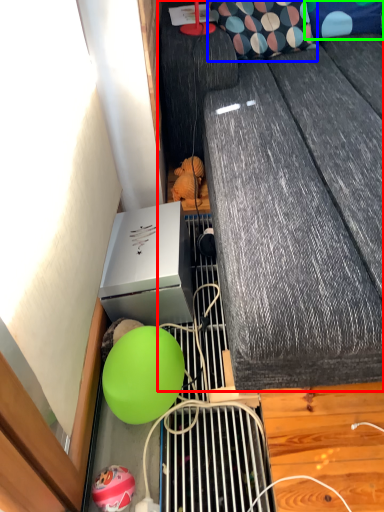
Question: Estimate the real-world distances between objects in this image. Which object is farther from furniture (highlighted by a red box), pillow (highlighted by a blue box) or pillow (highlighted by a green box)?

Choices:
 (A) pillow
 (B) pillow

Answer: (B)